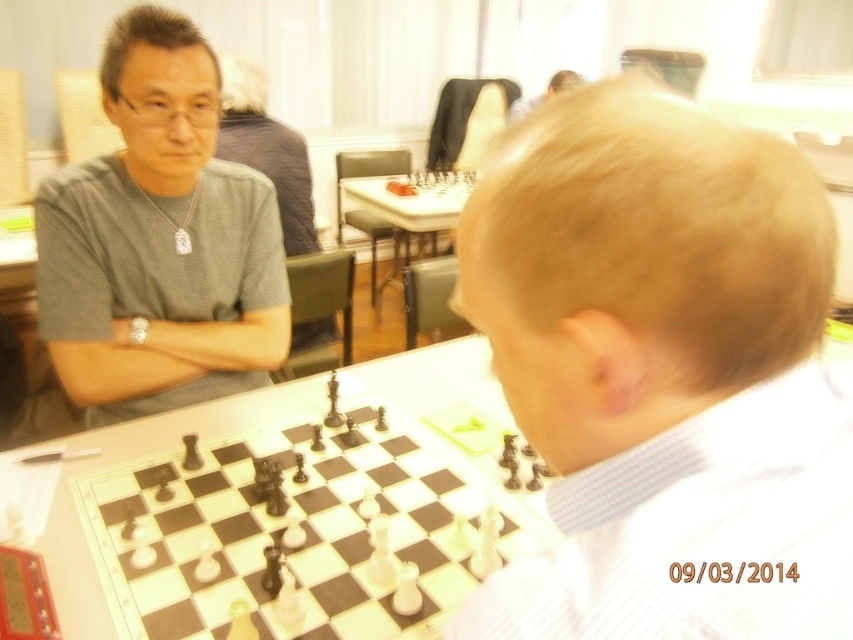
Which is more to the right, smooth blonde hair at center or smooth skin head at upper center?

smooth skin head at upper center

Is smooth blonde hair at center shorter than smooth skin head at upper center?

Yes, smooth blonde hair at center is shorter than smooth skin head at upper center.

Which is in front, point (682, 396) or point (560, 70)?

Point (682, 396) is in front.

You are a GUI agent. You are given a task and a screenshot of the screen. Output one action in this format:
    pyautogui.click(x=<x>, y=<y>)
    Task: Click on the smooth blonde hair at center
    The width and height of the screenshot is (853, 640).
    Given the screenshot: What is the action you would take?
    pyautogui.click(x=662, y=372)

Is gray matte shirt at upper left positioned behind smooth skin head at upper center?

No.

Is the position of gray matte shirt at upper left less distant than that of smooth skin head at upper center?

Yes, gray matte shirt at upper left is in front of smooth skin head at upper center.

The height and width of the screenshot is (640, 853). Identify the location of gray matte shirt at upper left. (160, 241).

Image resolution: width=853 pixels, height=640 pixels. Describe the element at coordinates (662, 372) in the screenshot. I see `smooth blonde hair at center` at that location.

Is point (693, 120) farther from camera compared to point (132, 179)?

No.

Where is `smooth blonde hair at center`? Image resolution: width=853 pixels, height=640 pixels. smooth blonde hair at center is located at coordinates (662, 372).

Identify the location of smooth blonde hair at center. The image size is (853, 640). (662, 372).